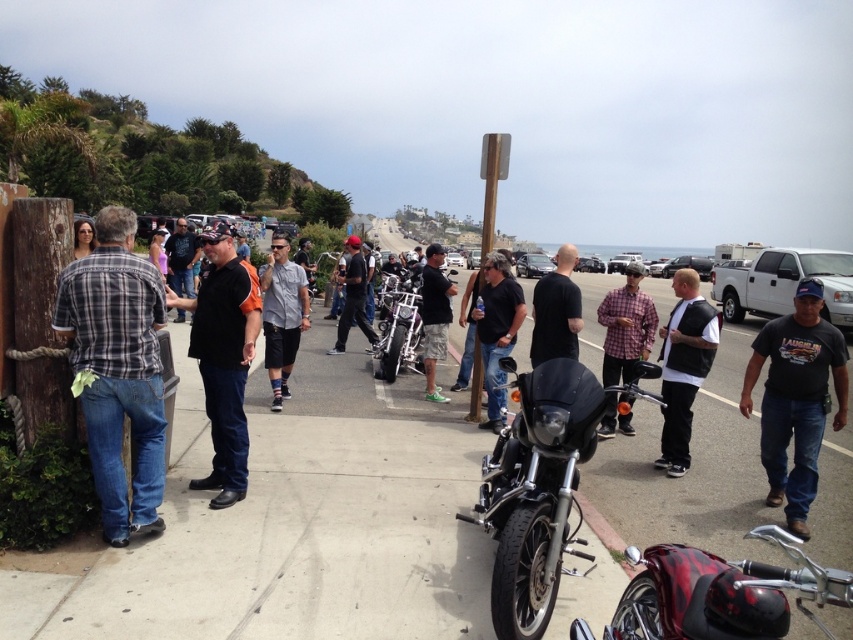
Question: Which of the following is the closest to the observer?

Choices:
 (A) (131, 284)
 (B) (573, 396)
 (C) (395, 308)

Answer: (B)

Question: Can you confirm if polished chrome motorcycle at center is bigger than matte black hair at center?

Choices:
 (A) no
 (B) yes

Answer: (B)

Question: Considering the real-world distances, which object is farthest from the black matte shirt at center?

Choices:
 (A) black smooth shirt at center
 (B) white matte vest at center
 (C) plaid fabric shirt at center

Answer: (A)

Question: Does concrete at center appear on the left side of black matte shirt at center?

Choices:
 (A) no
 (B) yes

Answer: (B)

Question: Can you confirm if plaid shirt at left is positioned below black smooth shirt at center?

Choices:
 (A) yes
 (B) no

Answer: (A)

Question: Among these points, which one is farthest from the camera?

Choices:
 (A) (503, 296)
 (B) (412, 368)
 (C) (828, 365)

Answer: (B)